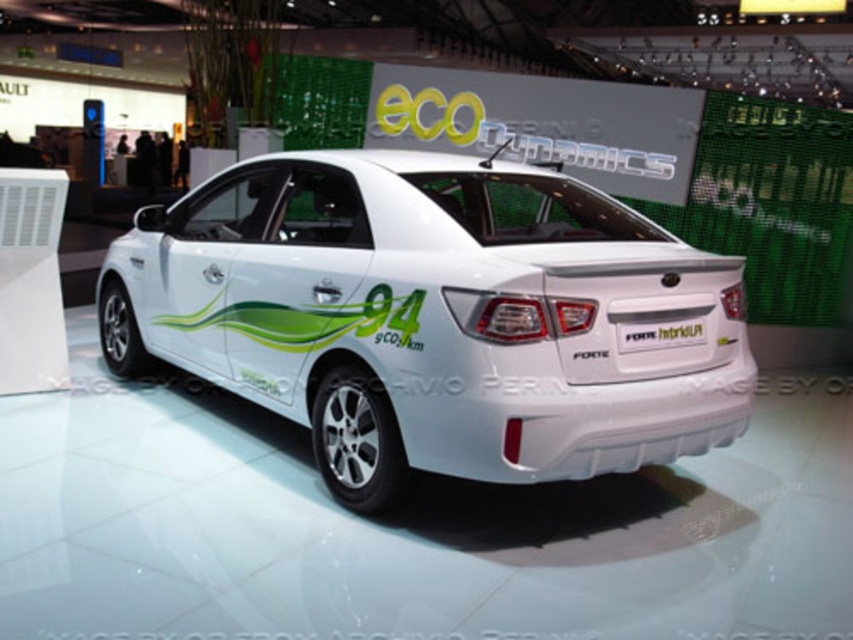
You are at an auto show and want to take a photo of the white glossy car at center. Since you want to include the white plastic license plate at center in the frame, will you need to zoom in or zoom out your camera?

The white glossy car at center is larger than the white plastic license plate at center. To include both in the frame without cropping the license plate, you should zoom out to capture both the car and the license plate at center.

You are standing at the front of the white Kia Forte Hybrid car at the exhibition. You notice two points marked on the car. The first point is at coordinate point (438, 381) and the second point is at coordinate point (619, 324). If you were to walk around the car from the front to the rear, which point would you encounter first?

Point (438, 381) is in front of point (619, 324), so you would encounter point (438, 381) first when walking around the car from the front to the rear.

You are a photographer standing in front of the white glossy car at center and the white plastic license plate at center. You want to take a clear photo of the license plate without the car blocking it. Is this possible given their positions?

The white glossy car at center is closer to the viewer than the white plastic license plate at center. Therefore, the car will block the license plate in the photo, making it impossible to capture a clear image of the license plate without the car obstructing it.